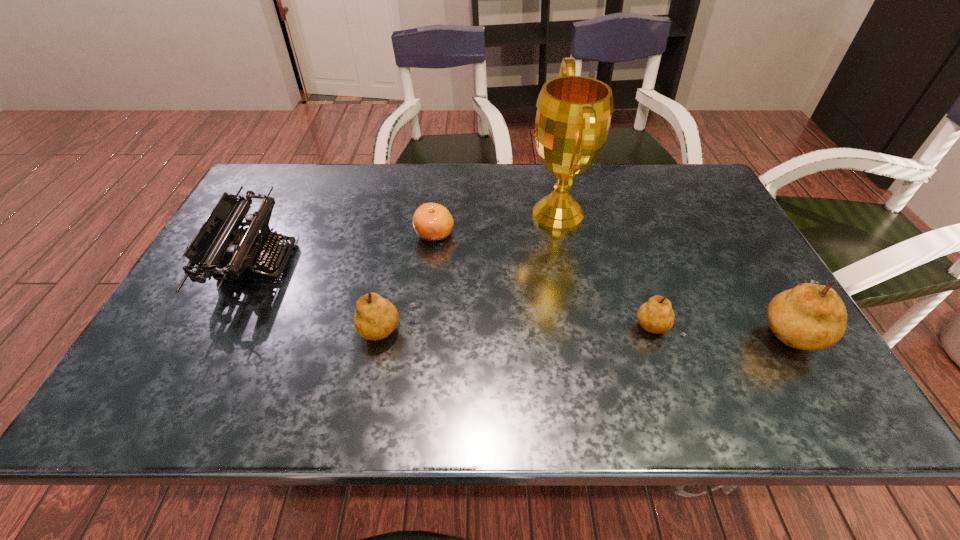
At what (x,y) coordinates should I click in order to perform the action: click on object located in the near right corner section of the desktop. Please return your answer as a coordinate pair (x, y). This screenshot has width=960, height=540. Looking at the image, I should click on (809, 317).

Locate an element on the screen. vacant space at the far edge is located at coordinates (449, 191).

The width and height of the screenshot is (960, 540). In the image, there is a desktop. What are the coordinates of `vacant region at the near edge` in the screenshot? It's located at (611, 353).

The image size is (960, 540). In the image, there is a desktop. Find the location of `free space at the left edge`. free space at the left edge is located at coordinates (227, 317).

At what (x,y) coordinates should I click in order to perform the action: click on free space at the right edge of the desktop. Please return your answer as a coordinate pair (x, y). This screenshot has width=960, height=540. Looking at the image, I should click on (769, 299).

What are the coordinates of `free region at the far left corner of the desktop` in the screenshot? It's located at (293, 166).

Find the location of a particular element. The width and height of the screenshot is (960, 540). vacant space at the near left corner of the desktop is located at coordinates pos(203,363).

At what (x,y) coordinates should I click in order to perform the action: click on vacant space at the far right corner. Please return your answer as a coordinate pair (x, y). The height and width of the screenshot is (540, 960). Looking at the image, I should click on (660, 174).

The width and height of the screenshot is (960, 540). I want to click on unoccupied area between the fifth object from left to right and the award, so click(x=607, y=273).

Identify the location of vacant region between the leftmost pear and the clementine. (411, 283).